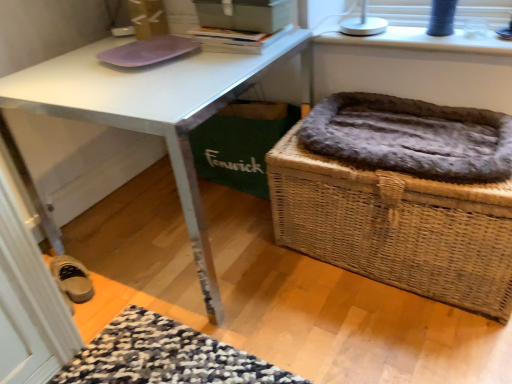
Identify the location of free location above fur-lined wicker basket at right (from a real-world perspective). Image resolution: width=512 pixels, height=384 pixels. (423, 138).